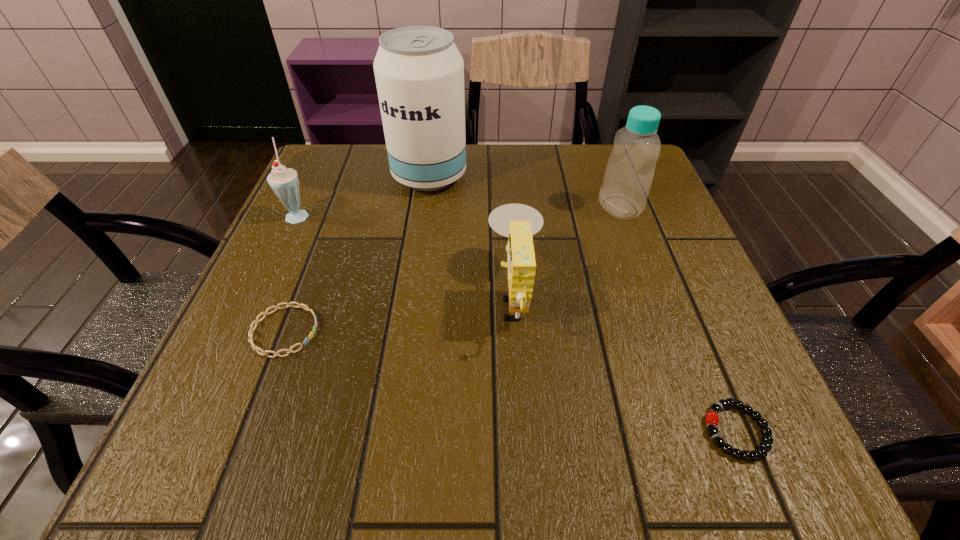
Identify the location of alcohol. The height and width of the screenshot is (540, 960). (419, 72).

At what (x,y) coordinates should I click in order to perform the action: click on the tallest object. Please return your answer as a coordinate pair (x, y). Looking at the image, I should click on (419, 72).

Locate an element on the screen. the second tallest object is located at coordinates (629, 173).

Where is `milkshake`? Image resolution: width=960 pixels, height=540 pixels. milkshake is located at coordinates (284, 182).

The image size is (960, 540). What are the coordinates of `sponge` in the screenshot? It's located at [x=518, y=222].

Where is `the left bracelet`? the left bracelet is located at coordinates (266, 312).

At what (x,y) coordinates should I click in order to perform the action: click on the right bracelet. Please return your answer as a coordinate pair (x, y). Looking at the image, I should click on (712, 418).

This screenshot has width=960, height=540. Identify the location of the nearest object. (712, 418).

The height and width of the screenshot is (540, 960). I want to click on blank space located 0.380m on the right of the fourth object from right to left, so (625, 176).

You are a GUI agent. You are given a task and a screenshot of the screen. Output one action in this format:
    pyautogui.click(x=<x>, y=<y>)
    Task: Click on the free location located on the back of the second tallest object
    This screenshot has width=960, height=540.
    Given the screenshot: What is the action you would take?
    pyautogui.click(x=601, y=156)